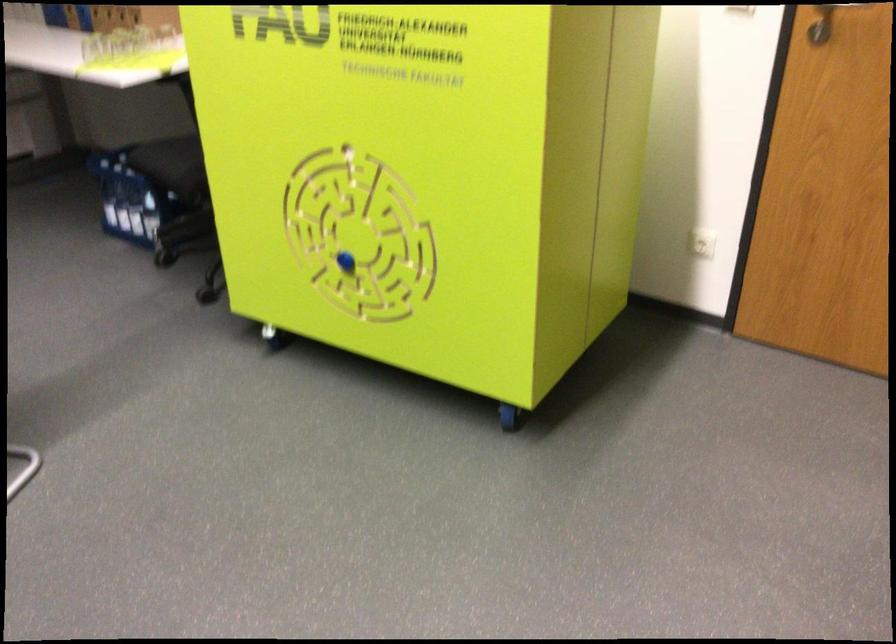
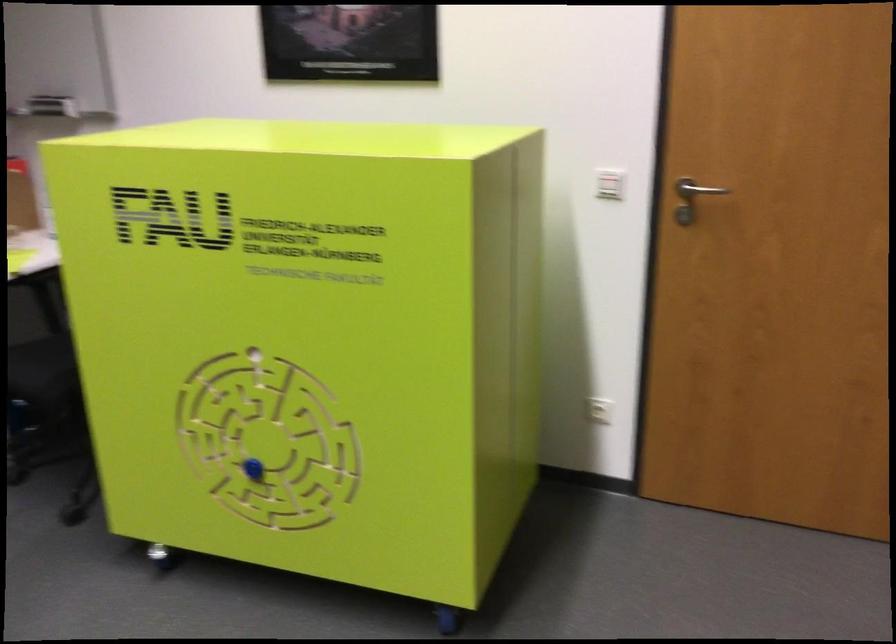
Find the pixel in the second image that matches the point at 395,143 in the first image.

(309, 341)